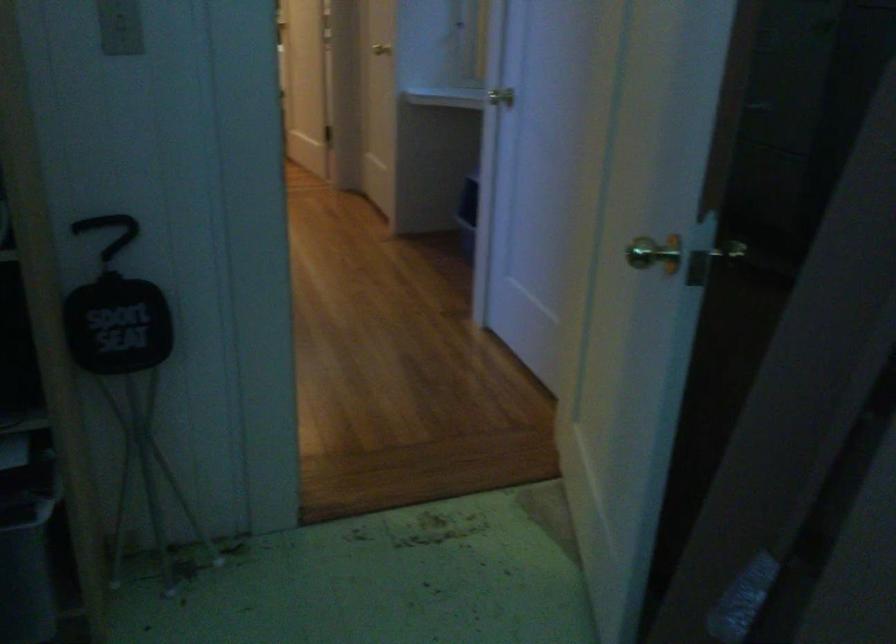
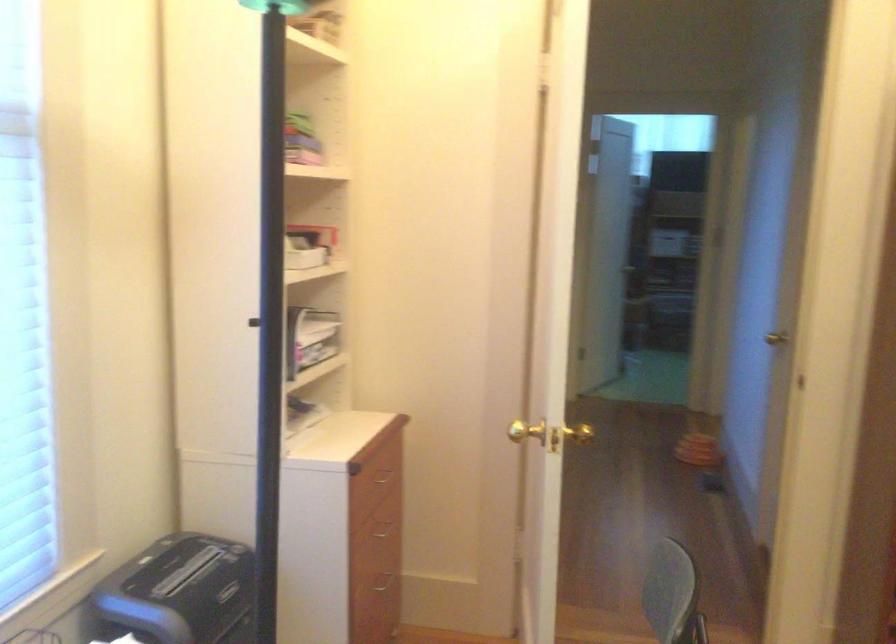
Question: I am providing you with two images of the same scene from different viewpoints. Please identify which objects are invisible in image2.

Choices:
 (A) drawer handle
 (B) chair sitting surface
 (C) gold door knob
 (D) suitcase carrying handle

Answer: (B)